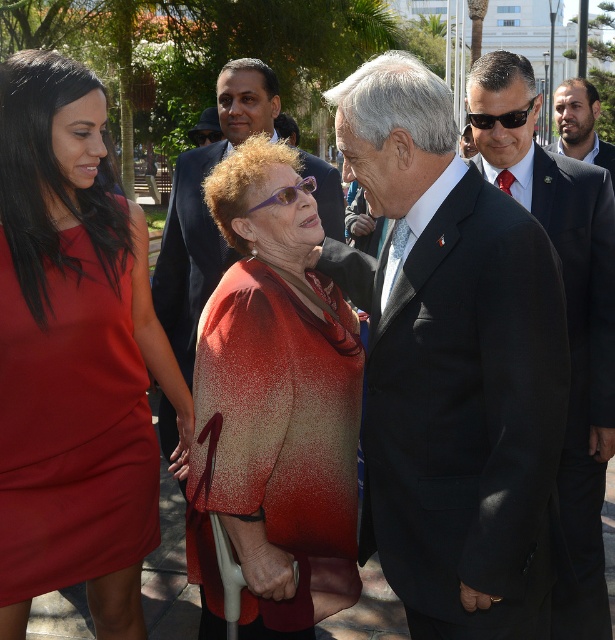
Can you confirm if black matte suit at center is positioned above speckled red coat at center?

Yes, black matte suit at center is above speckled red coat at center.

In the scene shown: Can you confirm if black matte suit at center is thinner than speckled red coat at center?

No.

Does point (520, 380) come in front of point (319, 568)?

Yes, it is in front of point (319, 568).

The image size is (615, 640). In order to click on black matte suit at center in this screenshot , I will do `click(451, 365)`.

This screenshot has width=615, height=640. Find the location of `black matte suit at center`. black matte suit at center is located at coordinates (451, 365).

Who is more distant from viewer, (x=435, y=257) or (x=577, y=467)?

The point (x=577, y=467) is more distant.

Locate an element on the screen. The width and height of the screenshot is (615, 640). black matte suit at center is located at coordinates (451, 365).

Where is `matte red dress at center`? Image resolution: width=615 pixels, height=640 pixels. matte red dress at center is located at coordinates (73, 348).

Where is `matte red dress at center`? Image resolution: width=615 pixels, height=640 pixels. matte red dress at center is located at coordinates (73, 348).